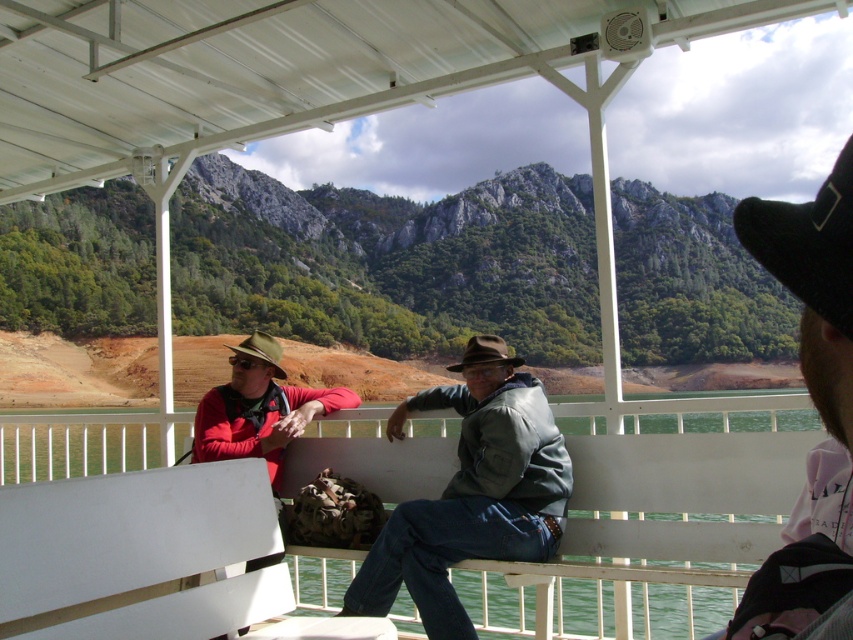
You are a photographer standing at the edge of the water. You want to take a photo of the white matte bench at lower left and the matte brown hat at upper right. Which object is positioned higher in the frame?

The matte brown hat at upper right is positioned higher in the frame than the white matte bench at lower left.

You are standing at the edge of the water and want to take a photo of the green forested mountain at center. Your camera has a maximum focus range of 70 meters. Will the mountain be in focus?

The green forested mountain at center is 75.68 meters away from viewer, which exceeds the camera maximum focus range of 70 meters. The mountain will not be in focus.